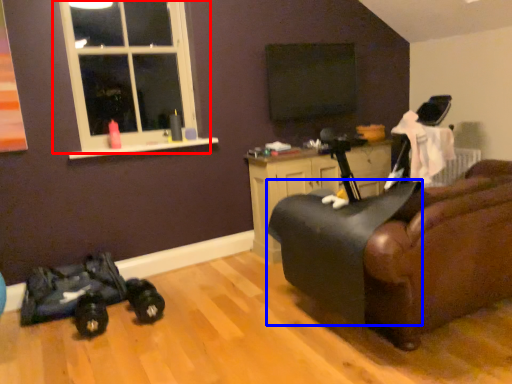
Question: Which of the following is the closest to the observer, window (highlighted by a red box) or swivel chair (highlighted by a blue box)?

Choices:
 (A) window
 (B) swivel chair

Answer: (B)